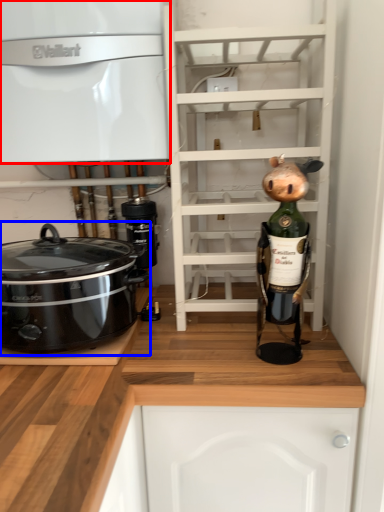
Question: Which point is further to the camera, cabinetry (highlighted by a red box) or home appliance (highlighted by a blue box)?

Choices:
 (A) cabinetry
 (B) home appliance

Answer: (A)